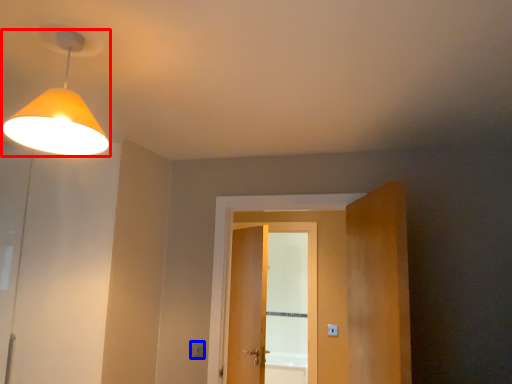
Question: Which of the following is the farthest to the observer, lamp (highlighted by a red box) or light switch (highlighted by a blue box)?

Choices:
 (A) lamp
 (B) light switch

Answer: (B)